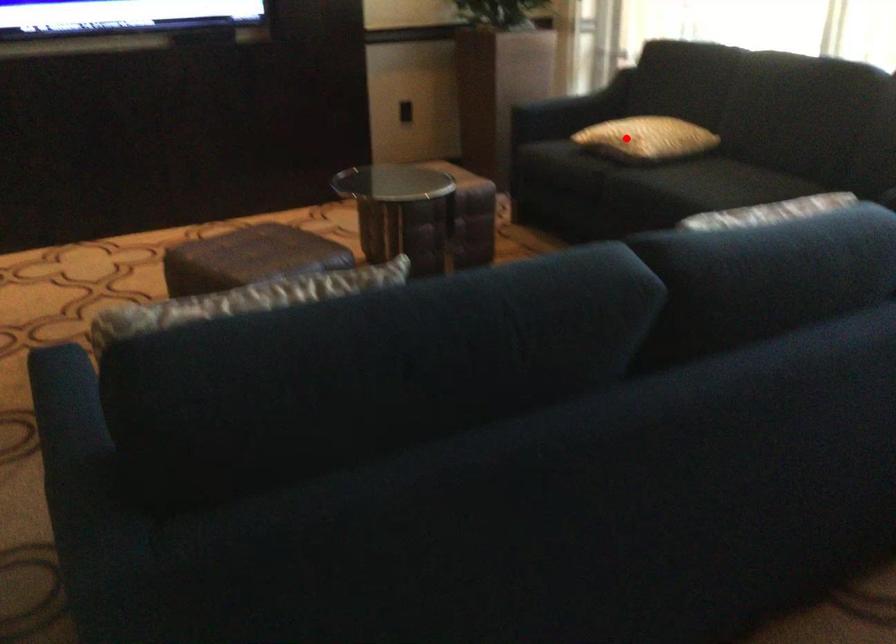
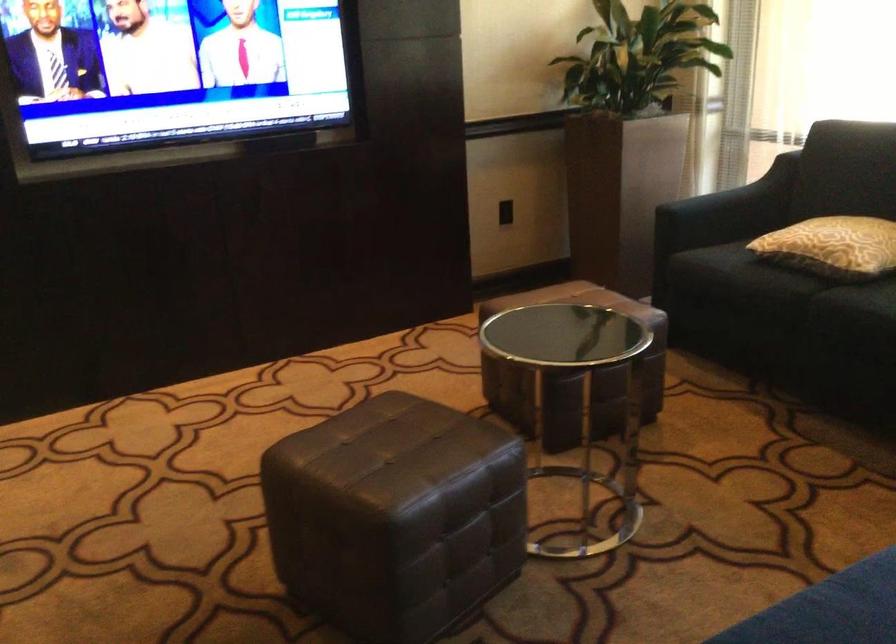
Question: A red point is marked in image1. In image2, is the corresponding 3D point closer to the camera or farther? Reply with the corresponding letter.

Choices:
 (A) The corresponding 3D point is closer.
 (B) The corresponding 3D point is farther.

Answer: (A)